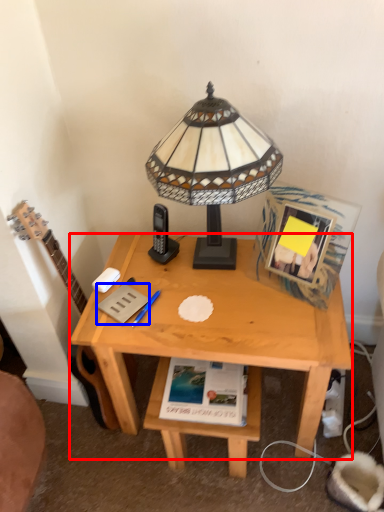
Question: Which object appears farthest to the camera in this image, desk (highlighted by a red box) or paperback book (highlighted by a blue box)?

Choices:
 (A) desk
 (B) paperback book

Answer: (B)